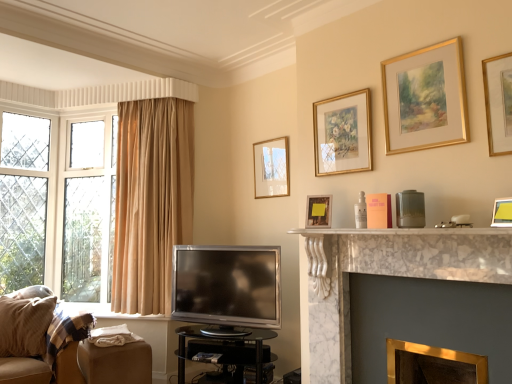
Question: Is transparent glass table at center shorter than gold-framed picture at upper right, which is the first picture frame in right-to-left order?

Choices:
 (A) no
 (B) yes

Answer: (B)

Question: Is transparent glass table at center closer to camera compared to gold-framed picture at upper right, acting as the fifth picture frame starting from the back?

Choices:
 (A) yes
 (B) no

Answer: (B)

Question: From the image's perspective, is transparent glass table at center over gold-framed picture at upper right, which is the first picture frame in right-to-left order?

Choices:
 (A) no
 (B) yes

Answer: (A)

Question: Is transparent glass table at center completely or partially outside of gold-framed picture at upper right, acting as the fifth picture frame starting from the back?

Choices:
 (A) no
 (B) yes

Answer: (B)

Question: Is transparent glass table at center far from gold-framed picture at upper right, which is the first picture frame in right-to-left order?

Choices:
 (A) yes
 (B) no

Answer: (A)

Question: From a real-world perspective, is gold-framed painting at upper center, which is the 4th picture frame from front to back, above or below matte gold picture frame at upper center, the 6th picture frame when ordered from right to left?

Choices:
 (A) below
 (B) above

Answer: (B)

Question: In terms of width, does gold-framed painting at upper center, which is the fourth picture frame from right to left, look wider or thinner when compared to matte gold picture frame at upper center, acting as the sixth picture frame starting from the front?

Choices:
 (A) wide
 (B) thin

Answer: (A)

Question: Is gold-framed painting at upper center, marked as the third picture frame in a left-to-right arrangement, spatially inside matte gold picture frame at upper center, acting as the sixth picture frame starting from the front, or outside of it?

Choices:
 (A) outside
 (B) inside

Answer: (A)

Question: From the image's perspective, relative to matte gold picture frame at upper center, which is the first picture frame from left to right, is gold-framed painting at upper center, the third picture frame in the back-to-front sequence, above or below?

Choices:
 (A) below
 (B) above

Answer: (B)

Question: Relative to matte gold picture frame at upper center, the second picture frame viewed from the left, is satin silver television at lower center in front or behind?

Choices:
 (A) behind
 (B) front

Answer: (A)

Question: Visually, is satin silver television at lower center positioned to the left or to the right of matte gold picture frame at upper center, the fifth picture frame from the front?

Choices:
 (A) right
 (B) left

Answer: (B)

Question: Considering the positions of satin silver television at lower center and matte gold picture frame at upper center, arranged as the 2th picture frame when viewed from the back, in the image, is satin silver television at lower center wider or thinner than matte gold picture frame at upper center, arranged as the 2th picture frame when viewed from the back,?

Choices:
 (A) wide
 (B) thin

Answer: (A)

Question: Is satin silver television at lower center situated inside matte gold picture frame at upper center, the second picture frame viewed from the left, or outside?

Choices:
 (A) inside
 (B) outside

Answer: (B)

Question: Relative to matte gold picture frame at upper center, arranged as the 2th picture frame when viewed from the back, is transparent glass table at center in front or behind?

Choices:
 (A) front
 (B) behind

Answer: (B)

Question: From their relative heights in the image, would you say transparent glass table at center is taller or shorter than matte gold picture frame at upper center, the second picture frame viewed from the left?

Choices:
 (A) short
 (B) tall

Answer: (B)